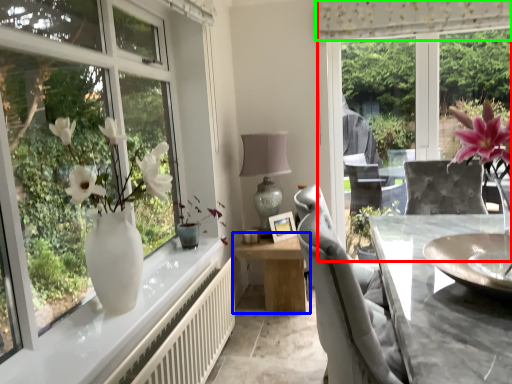
Question: Considering the real-world distances, which object is closest to window screen (highlighted by a red box)? table (highlighted by a blue box) or curtain (highlighted by a green box).

Choices:
 (A) table
 (B) curtain

Answer: (B)